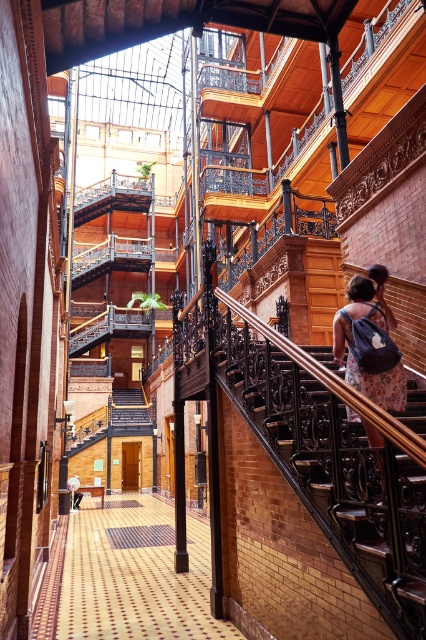
Question: Can you confirm if metallic grate at center is bigger than light brown leather backpack at lower left?

Choices:
 (A) no
 (B) yes

Answer: (B)

Question: Does floral fabric dress at center have a lesser width compared to metallic grate at center?

Choices:
 (A) yes
 (B) no

Answer: (B)

Question: From the image, what is the correct spatial relationship of polished brass stair at center in relation to floral fabric dress at center?

Choices:
 (A) left
 (B) right

Answer: (A)

Question: Estimate the real-world distances between objects in this image. Which object is farther from the light brown leather backpack at lower left?

Choices:
 (A) metallic grate at center
 (B) polished brass stair at center

Answer: (B)

Question: Based on their relative distances, which object is nearer to the polished brass stair at center?

Choices:
 (A) brick floor at lower center
 (B) light brown leather backpack at lower left

Answer: (A)

Question: Which object is positioned farthest from the brick floor at lower center?

Choices:
 (A) metallic grate at center
 (B) floral fabric dress at center
 (C) light brown leather backpack at lower left
 (D) polished brass stair at center

Answer: (B)